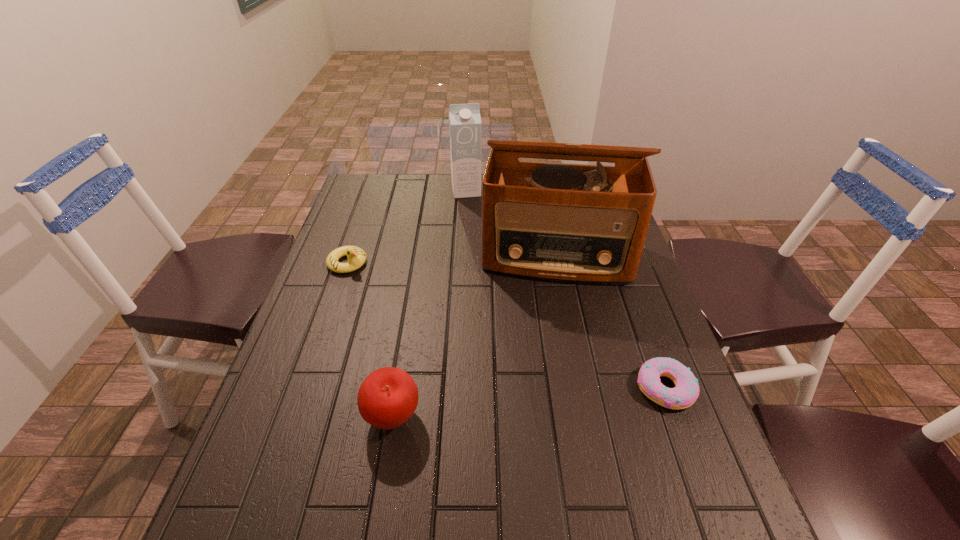
Where is `blank space located 0.290m on the front panel of the radio receiver`? Image resolution: width=960 pixels, height=540 pixels. blank space located 0.290m on the front panel of the radio receiver is located at coordinates (551, 375).

Identify the location of free space located 0.290m on the front panel of the radio receiver. (551, 375).

You are a GUI agent. You are given a task and a screenshot of the screen. Output one action in this format:
    pyautogui.click(x=<x>, y=<y>)
    Task: Click on the vacant space located 0.230m on the front panel of the radio receiver
    The width and height of the screenshot is (960, 540).
    Given the screenshot: What is the action you would take?
    pyautogui.click(x=551, y=354)

Where is `vacant space situated on the face of the leftmost object`? Image resolution: width=960 pixels, height=540 pixels. vacant space situated on the face of the leftmost object is located at coordinates (443, 344).

Find the location of `blank space located on the face of the leftmost object`. blank space located on the face of the leftmost object is located at coordinates (419, 323).

Image resolution: width=960 pixels, height=540 pixels. In order to click on vacant point located on the face of the leftmost object in this screenshot , I will do `click(371, 282)`.

At what (x,y) coordinates should I click in order to perform the action: click on free space located on the front label of the farthest object. Please return your answer as a coordinate pair (x, y). Image resolution: width=960 pixels, height=540 pixels. Looking at the image, I should click on (474, 229).

This screenshot has height=540, width=960. Identify the location of vacant region located 0.090m on the front label of the farthest object. (470, 213).

Image resolution: width=960 pixels, height=540 pixels. In order to click on vacant area situated 0.210m on the front label of the farthest object in this screenshot , I will do `click(475, 234)`.

Locate an element on the screen. This screenshot has width=960, height=540. object positioned at the far edge is located at coordinates (464, 119).